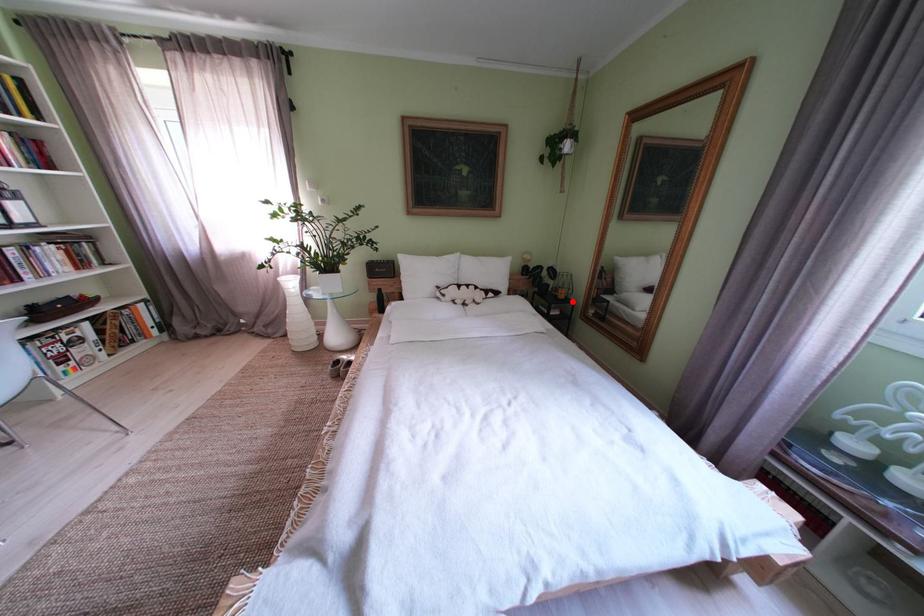
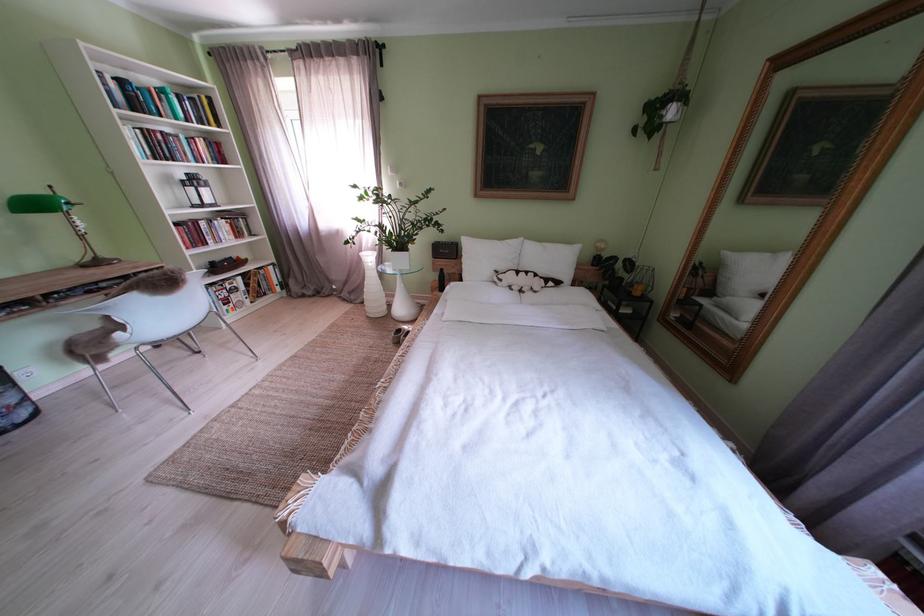
Question: I am providing you with two images of the same scene from different viewpoints. A red point is shown in image1. For the corresponding object point in image2, is it positioned nearer or farther from the camera?

Choices:
 (A) Nearer
 (B) Farther

Answer: (A)